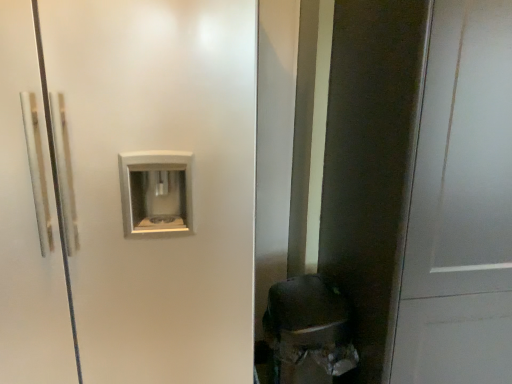
The width and height of the screenshot is (512, 384). What do you see at coordinates (460, 205) in the screenshot?
I see `matte black door at right` at bounding box center [460, 205].

Image resolution: width=512 pixels, height=384 pixels. I want to click on matte black door at right, so click(x=460, y=205).

The image size is (512, 384). Identify the location of white matte screen door at center. (156, 164).

The width and height of the screenshot is (512, 384). What do you see at coordinates (156, 164) in the screenshot?
I see `white matte screen door at center` at bounding box center [156, 164].

At what (x,y) coordinates should I click in order to perform the action: click on matte black door at right. Please return your answer as a coordinate pair (x, y). This screenshot has height=384, width=512. Looking at the image, I should click on (460, 205).

Which object is positioned more to the right, white matte screen door at center or matte black door at right?

Positioned to the right is matte black door at right.

Does white matte screen door at center come behind matte black door at right?

Yes, it is.

Is point (237, 167) in front of point (439, 58)?

No, (237, 167) is behind (439, 58).

From the image's perspective, who appears lower, white matte screen door at center or matte black door at right?

matte black door at right, from the image's perspective.

From a real-world perspective, between white matte screen door at center and matte black door at right, who is vertically higher?

In real-world perspective, white matte screen door at center is above.

Between white matte screen door at center and matte black door at right, which one has smaller width?

matte black door at right.

Which of these two, white matte screen door at center or matte black door at right, stands taller?

white matte screen door at center is taller.

Which of these two, white matte screen door at center or matte black door at right, is smaller?

Smaller between the two is matte black door at right.

Would you say white matte screen door at center contains matte black door at right?

Definitely not — matte black door at right is not inside white matte screen door at center.

Is white matte screen door at center not close to matte black door at right?

No, white matte screen door at center is not far from matte black door at right.

Could you tell me if white matte screen door at center is turned towards matte black door at right?

No, white matte screen door at center does not turn towards matte black door at right.

How many degrees apart are the facing directions of white matte screen door at center and matte black door at right?

white matte screen door at center and matte black door at right are facing 1.51 degrees away from each other.

The image size is (512, 384). Find the location of `door on the right of white matte screen door at center`. door on the right of white matte screen door at center is located at coordinates (460, 205).

Visually, is matte black door at right positioned to the left or to the right of white matte screen door at center?

Clearly, matte black door at right is on the right of white matte screen door at center in the image.

Is matte black door at right further to camera compared to white matte screen door at center?

No, it is not.

Consider the image. Which point is more distant from viewer, [465,303] or [204,90]?

The point [465,303] is farther from the camera.

Based on the photo, from the image's perspective, is matte black door at right above white matte screen door at center?

No.

From a real-world perspective, who is located higher, matte black door at right or white matte screen door at center?

white matte screen door at center, from a real-world perspective.

Looking at their sizes, would you say matte black door at right is wider or thinner than white matte screen door at center?

Considering their sizes, matte black door at right looks slimmer than white matte screen door at center.

Looking at this image, considering the relative sizes of matte black door at right and white matte screen door at center in the image provided, is matte black door at right shorter than white matte screen door at center?

Yes.

Consider the image. Who is smaller, matte black door at right or white matte screen door at center?

matte black door at right.

Is white matte screen door at center located within matte black door at right?

That's incorrect, white matte screen door at center is not inside matte black door at right.

Is matte black door at right touching white matte screen door at center?

No, matte black door at right is not in contact with white matte screen door at center.

Could you tell me if matte black door at right is turned towards white matte screen door at center?

No, matte black door at right is not turned towards white matte screen door at center.

You are a GUI agent. You are given a task and a screenshot of the screen. Output one action in this format:
    pyautogui.click(x=<x>, y=<y>)
    Task: Click on the door below the white matte screen door at center (from the image's perspective)
    
    Given the screenshot: What is the action you would take?
    pyautogui.click(x=460, y=205)

At what (x,y) coordinates should I click in order to perform the action: click on door that is on the right side of white matte screen door at center. Please return your answer as a coordinate pair (x, y). Image resolution: width=512 pixels, height=384 pixels. Looking at the image, I should click on (460, 205).

At what (x,y) coordinates should I click in order to perform the action: click on screen door on the left side of matte black door at right. Please return your answer as a coordinate pair (x, y). The width and height of the screenshot is (512, 384). Looking at the image, I should click on (156, 164).